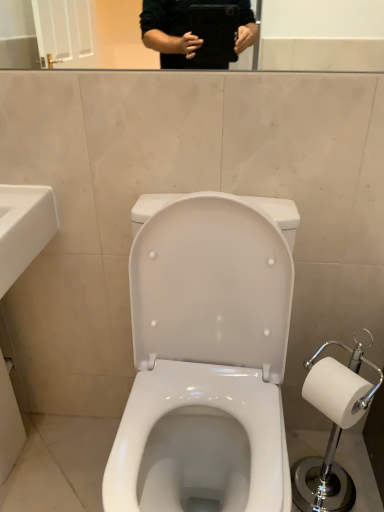
Question: Is point (43, 231) closer or farther from the camera than point (319, 368)?

Choices:
 (A) closer
 (B) farther

Answer: (B)

Question: Is white ceramic sink at lower left to the left or to the right of white plastic toilet paper holder at right in the image?

Choices:
 (A) right
 (B) left

Answer: (B)

Question: Considering the real-world distances, which object is closest to the white ceramic sink at lower left?

Choices:
 (A) white plastic toilet paper holder at right
 (B) white glossy toilet at center

Answer: (B)

Question: Estimate the real-world distances between objects in this image. Which object is farther from the white plastic toilet paper holder at right?

Choices:
 (A) white ceramic sink at lower left
 (B) white glossy toilet at center

Answer: (A)